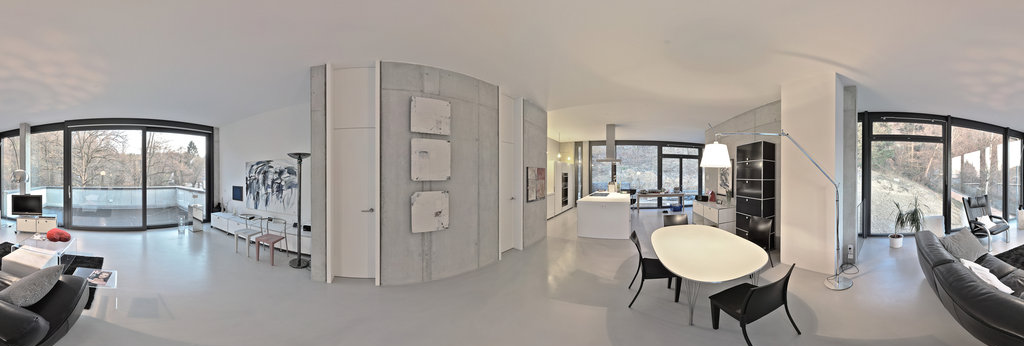
This screenshot has height=346, width=1024. Identify the location of wall. (479, 196).